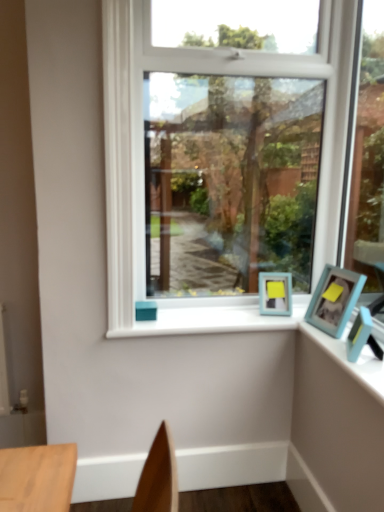
Question: Is blue plastic photo frame at upper right bigger or smaller than white painted wood at center?

Choices:
 (A) small
 (B) big

Answer: (A)

Question: Considering the relative positions of blue plastic photo frame at upper right and white painted wood at center in the image provided, is blue plastic photo frame at upper right to the left or to the right of white painted wood at center?

Choices:
 (A) left
 (B) right

Answer: (B)

Question: Which object is the farthest from the blue plastic photo frame at upper right?

Choices:
 (A) light blue plastic picture frame at right, which is the second picture frame from front to back
 (B) teal matte picture frame at right, the first picture frame viewed from the front
 (C) clear glass window at center
 (D) white painted wood at center

Answer: (C)

Question: Which of these objects is positioned farthest from the white painted wood at center?

Choices:
 (A) teal matte picture frame at right, which is the second picture frame in back-to-front order
 (B) clear glass window at center
 (C) light blue plastic picture frame at right, which is the 1th picture frame from back to front
 (D) blue plastic photo frame at upper right

Answer: (A)